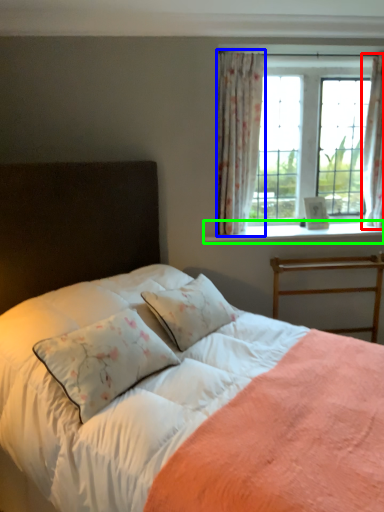
Question: Based on their relative distances, which object is nearer to curtain (highlighted by a red box)? Choose from curtain (highlighted by a blue box) and window sill (highlighted by a green box).

Choices:
 (A) curtain
 (B) window sill

Answer: (B)